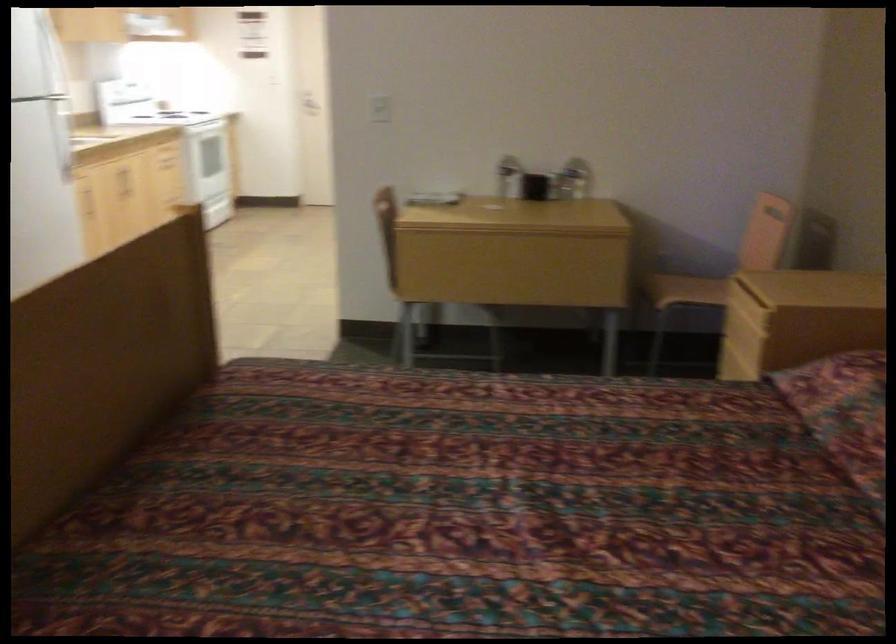
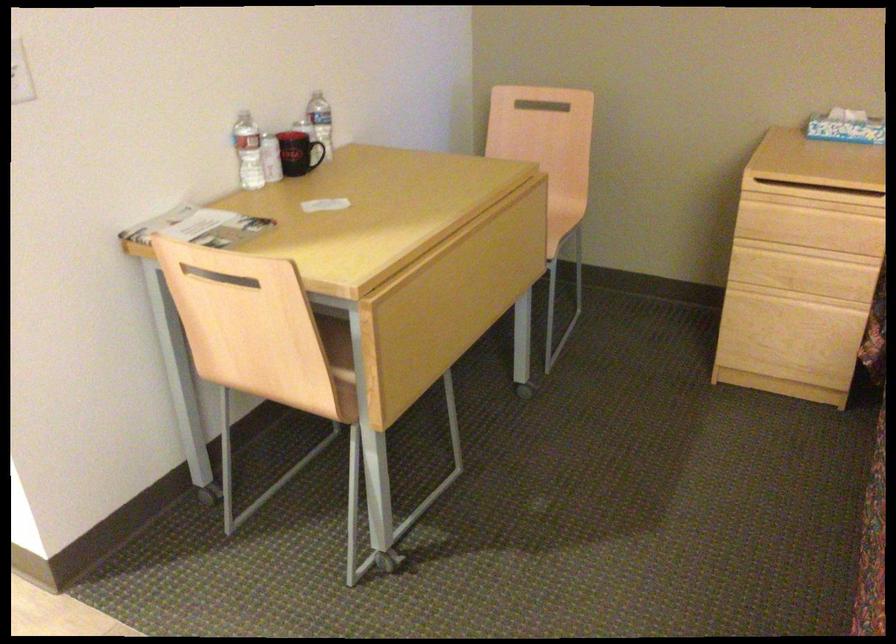
The point at [416,212] is marked in the first image. Where is the corresponding point in the second image?

(220, 277)